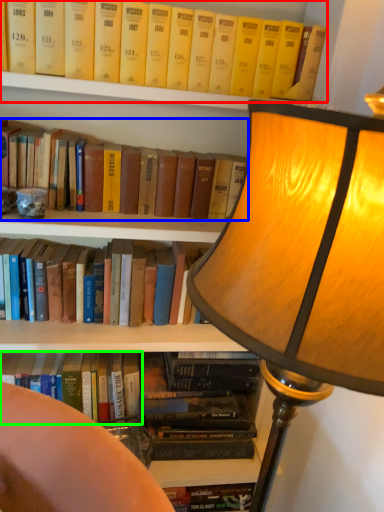
Question: Which object is positioned farthest from book (highlighted by a red box)? Select from book (highlighted by a blue box) and book (highlighted by a green box).

Choices:
 (A) book
 (B) book

Answer: (B)